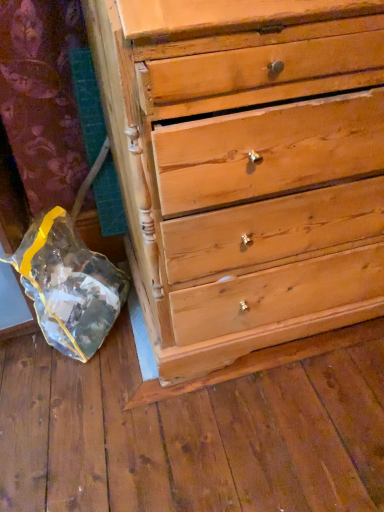
Measure the distance between point (57, 340) and camera.

Point (57, 340) and camera are 4.05 feet apart from each other.

Measure the distance between transparent plastic bag at lower left and camera.

The distance of transparent plastic bag at lower left from camera is 1.08 meters.

Where is `transparent plastic bag at lower left`? This screenshot has height=512, width=384. transparent plastic bag at lower left is located at coordinates (68, 285).

The image size is (384, 512). Describe the element at coordinates (68, 285) in the screenshot. I see `transparent plastic bag at lower left` at that location.

Image resolution: width=384 pixels, height=512 pixels. Find the location of `transparent plastic bag at lower left`. transparent plastic bag at lower left is located at coordinates (68, 285).